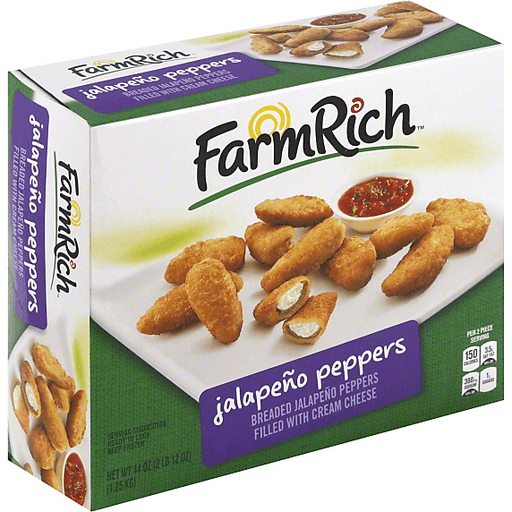
In order to click on white plate in this screenshot , I will do `click(224, 349)`, `click(58, 341)`, `click(374, 47)`.